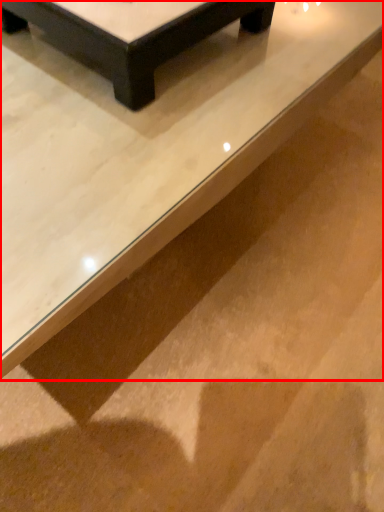
Question: Where is table (annotated by the red box) located in relation to table in the image?

Choices:
 (A) right
 (B) left

Answer: (B)